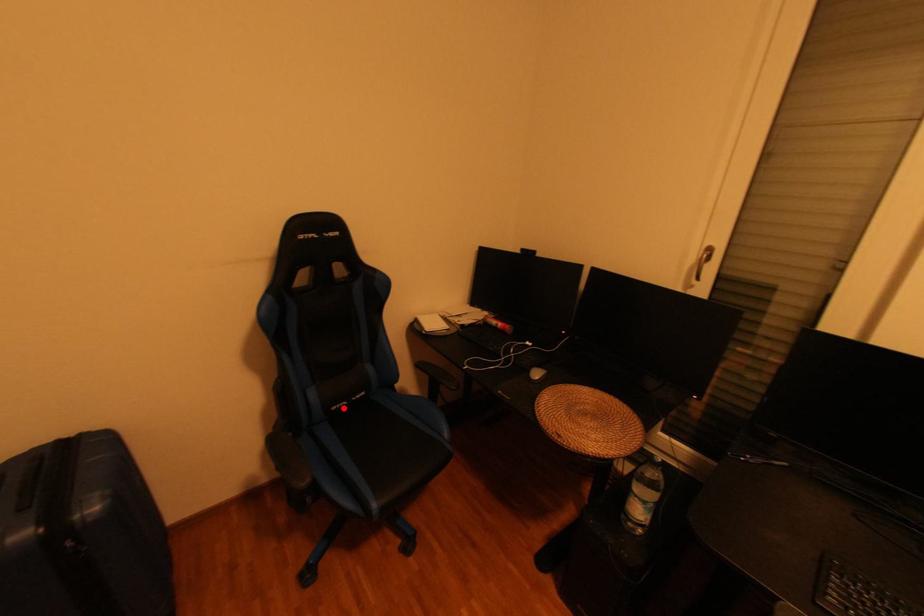
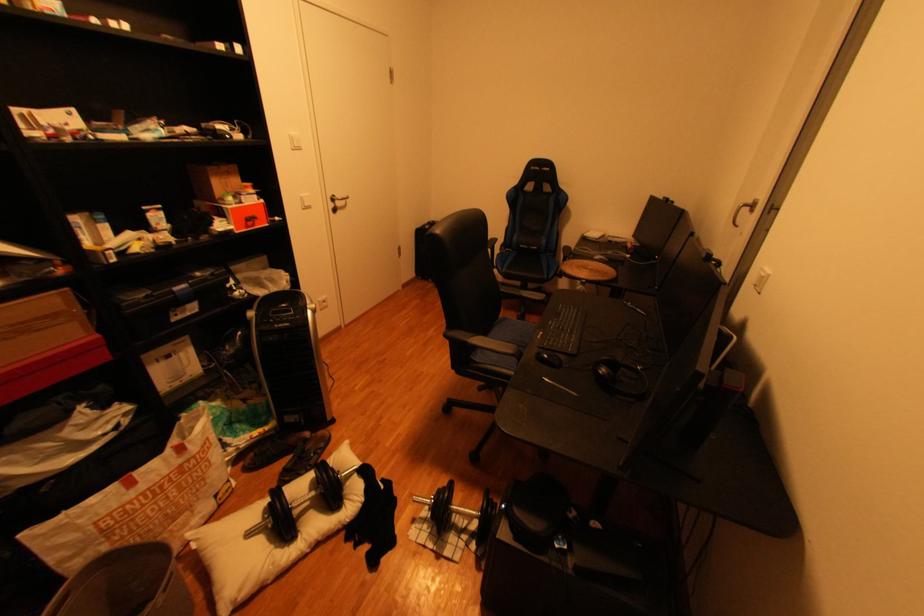
Where in the second image is the point corresponding to the highlighted location from the first image?

(531, 246)